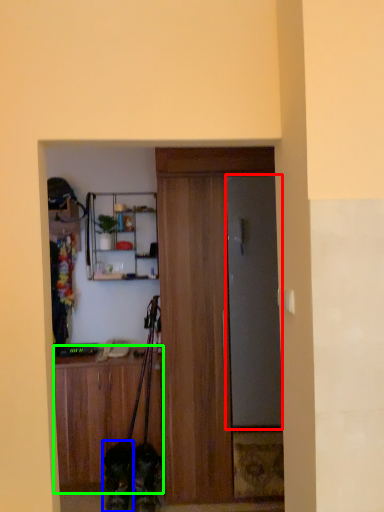
Question: Which object is positioned closest to door (highlighted by a red box)? Select from dog (highlighted by a blue box) and cabinetry (highlighted by a green box).

Choices:
 (A) dog
 (B) cabinetry

Answer: (B)